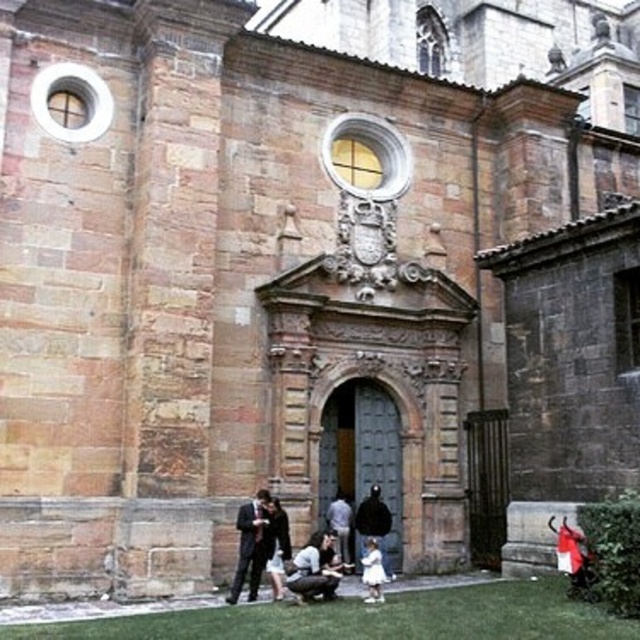
What do you see at coordinates (369, 618) in the screenshot? This screenshot has height=640, width=640. I see `green grass at lower center` at bounding box center [369, 618].

Who is more forward, (99, 621) or (268, 540)?

Positioned in front is point (99, 621).

This screenshot has width=640, height=640. I want to click on green grass at lower center, so click(369, 618).

Based on the photo, which is below, dark gray suit at lower center or dark blue suit at center?

dark blue suit at center is lower down.

Measure the distance from dark gray suit at lower center to dark blue suit at center.

dark gray suit at lower center and dark blue suit at center are 21.45 feet apart from each other.

Does point (269, 516) lie behind point (326, 515)?

No, it is in front of (326, 515).

Image resolution: width=640 pixels, height=640 pixels. What are the coordinates of `dark gray suit at lower center` in the screenshot? It's located at (276, 547).

Is point (308, 596) more distant than point (365, 545)?

No, (308, 596) is closer to viewer.

Which is above, matte black jacket at lower center or black matte coat at center?

black matte coat at center is above.

Is point (332, 572) closer to viewer compared to point (368, 512)?

Yes, it is in front of point (368, 512).

Locate an element on the screen. This screenshot has height=640, width=640. matte black jacket at lower center is located at coordinates (310, 572).